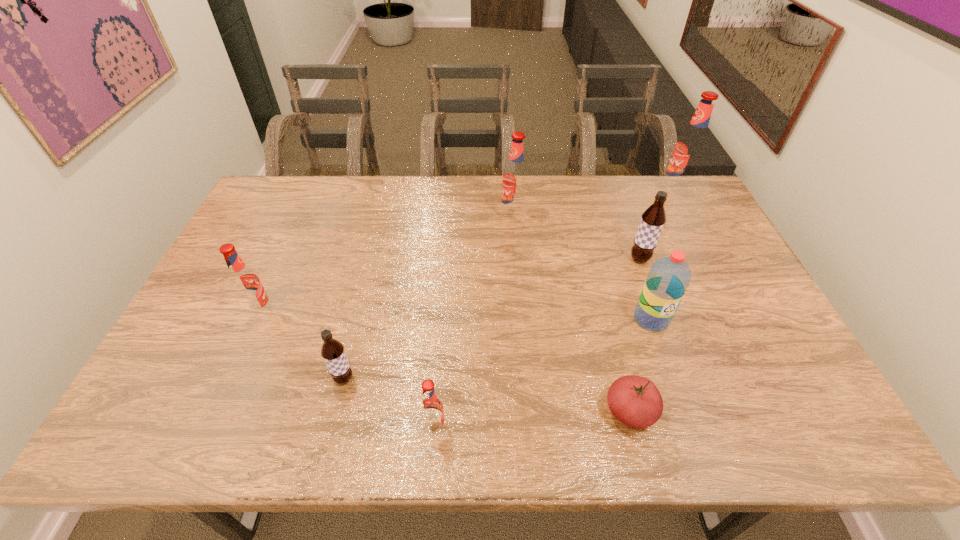
Identify the location of vacant area that satisfies the following two spatial constraints: 1. on the front side of the third farthest red root beer; 2. on the right side of the second red root beer from left to right. (210, 427).